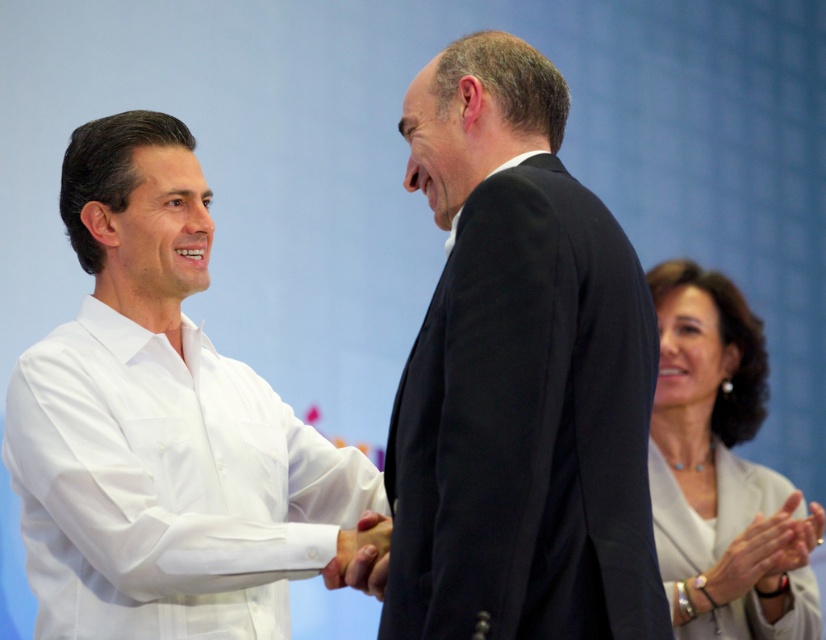
You are a photographer trying to capture a candid shot of both the white silk blouse at right and the smooth skin hand at lower right. Since you want to ensure both are in focus, you need to know which one is closer to the camera. Can you determine which object is closer based on their sizes in the image?

The white silk blouse at right is taller than the smooth skin hand at lower right, which means it is closer to the camera since objects closer to the lens appear larger in the photo.